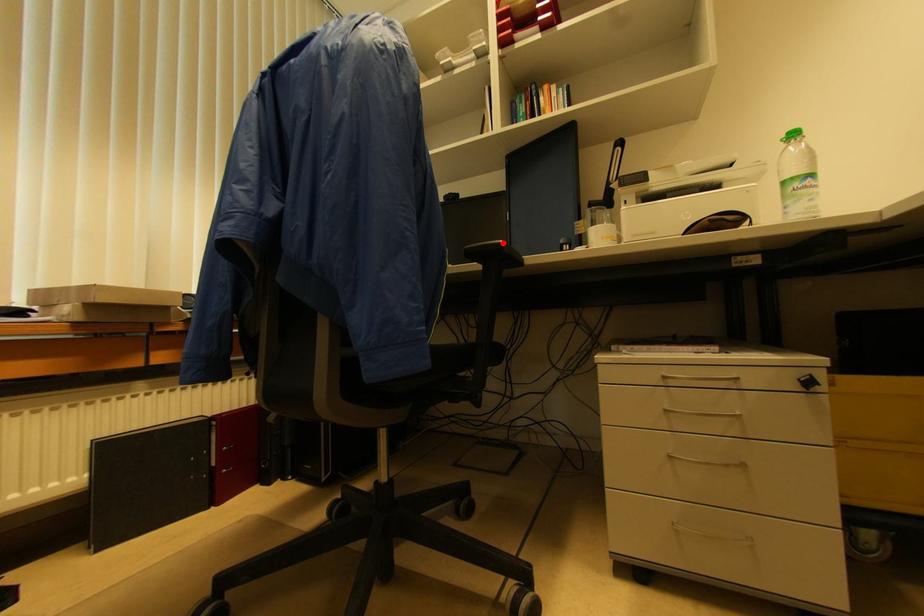
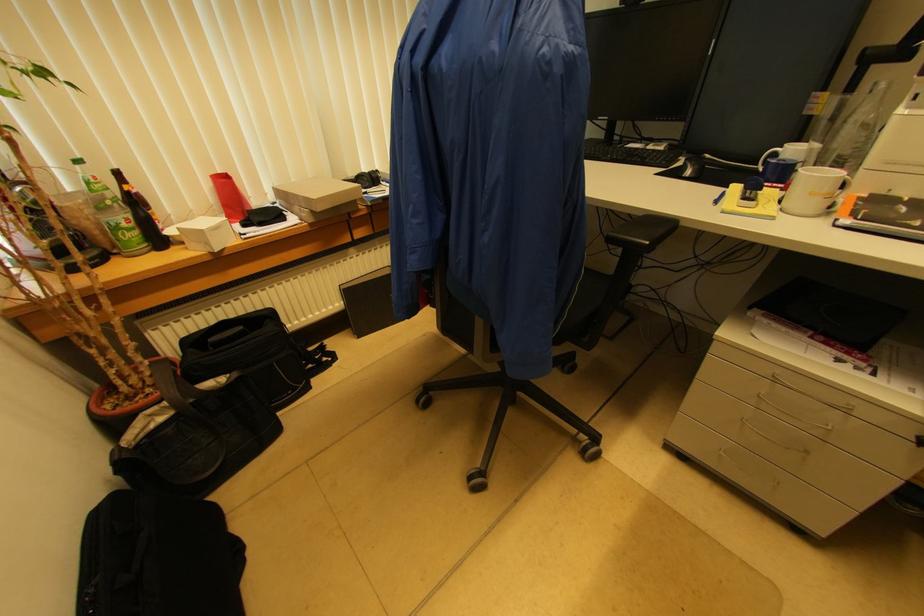
Locate, in the second image, the point that corresponds to the highlighted location in the first image.

(650, 245)